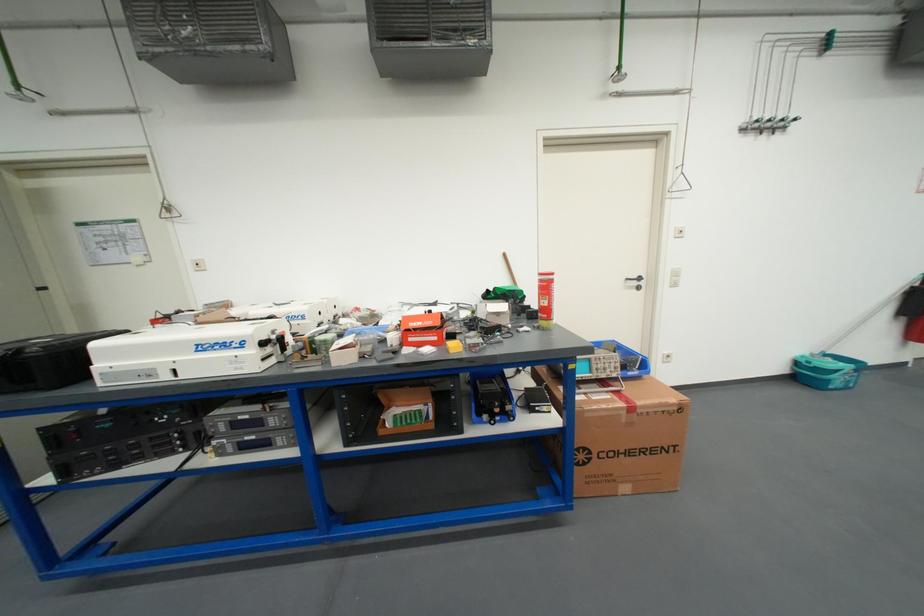
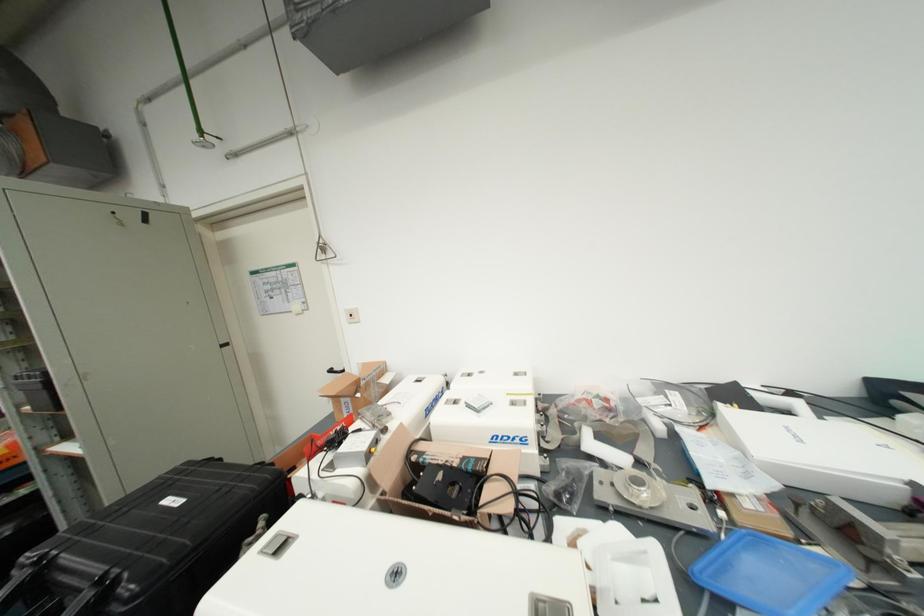
What movement of the cameraman would produce the second image?

The cameraman moved toward left, forward.